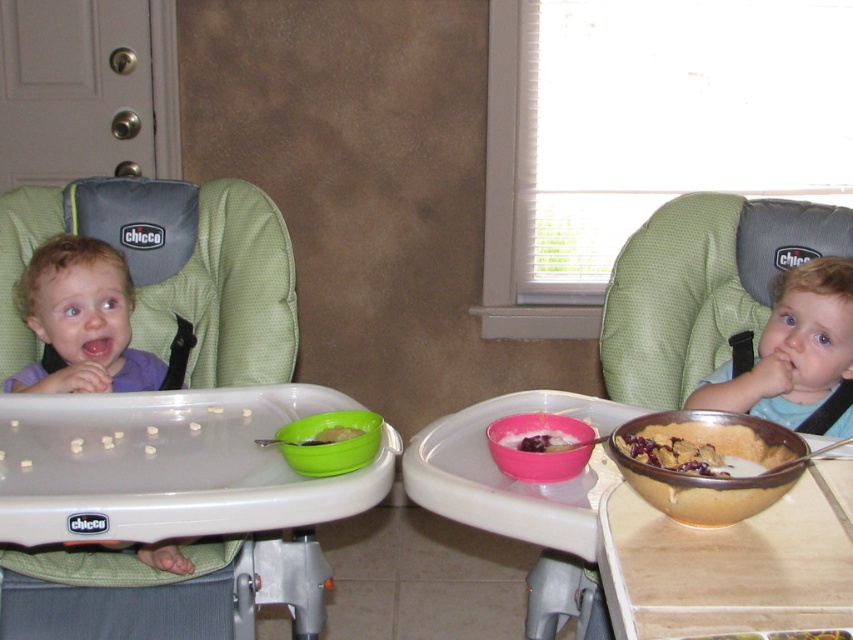
Does point (527, 440) come behind point (331, 440)?

No.

Is the position of smooth pink bowl at center less distant than that of green plastic bowl at center?

Yes, it is.

The height and width of the screenshot is (640, 853). What are the coordinates of `smooth pink bowl at center` in the screenshot? It's located at click(543, 442).

You are a GUI agent. You are given a task and a screenshot of the screen. Output one action in this format:
    pyautogui.click(x=<x>, y=<y>)
    Task: Click on the smooth pink bowl at center
    This screenshot has width=853, height=640.
    Given the screenshot: What is the action you would take?
    [x=543, y=442]

Consider the image. Can you confirm if matte purple shirt at left is smaller than smooth pink bowl at center?

No.

Who is taller, matte purple shirt at left or smooth pink bowl at center?

matte purple shirt at left is taller.

You are a GUI agent. You are given a task and a screenshot of the screen. Output one action in this format:
    pyautogui.click(x=<x>, y=<y>)
    Task: Click on the matte purple shirt at left
    The image size is (853, 640).
    Given the screenshot: What is the action you would take?
    pyautogui.click(x=80, y=321)

Where is `matte purple shirt at left`? The height and width of the screenshot is (640, 853). matte purple shirt at left is located at coordinates (80, 321).

Is matte purple shirt at left thinner than blue matte shirt at upper right?

Indeed, matte purple shirt at left has a lesser width compared to blue matte shirt at upper right.

Is point (125, 376) more distant than point (805, 374)?

Yes.

Find the location of a particular element. The image size is (853, 640). matte purple shirt at left is located at coordinates (80, 321).